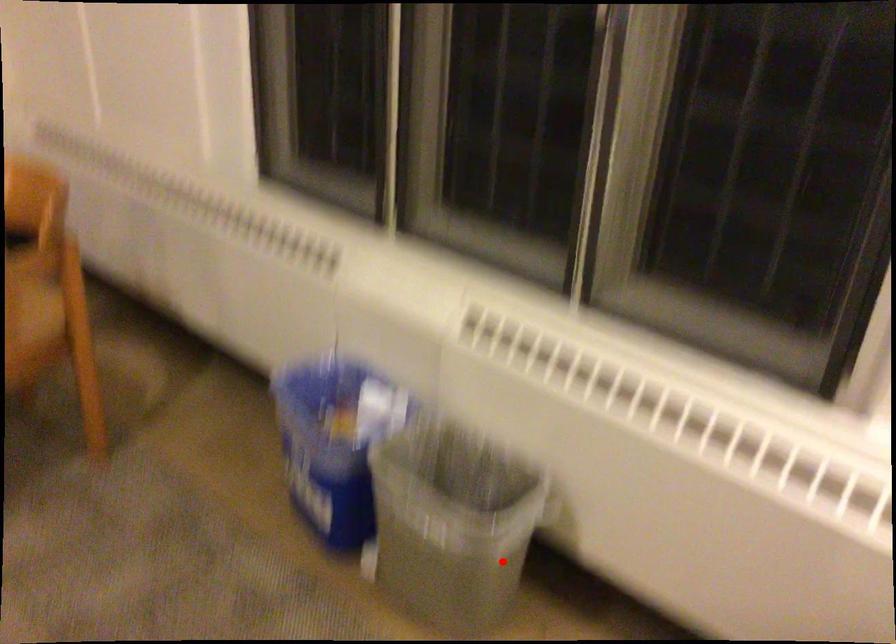
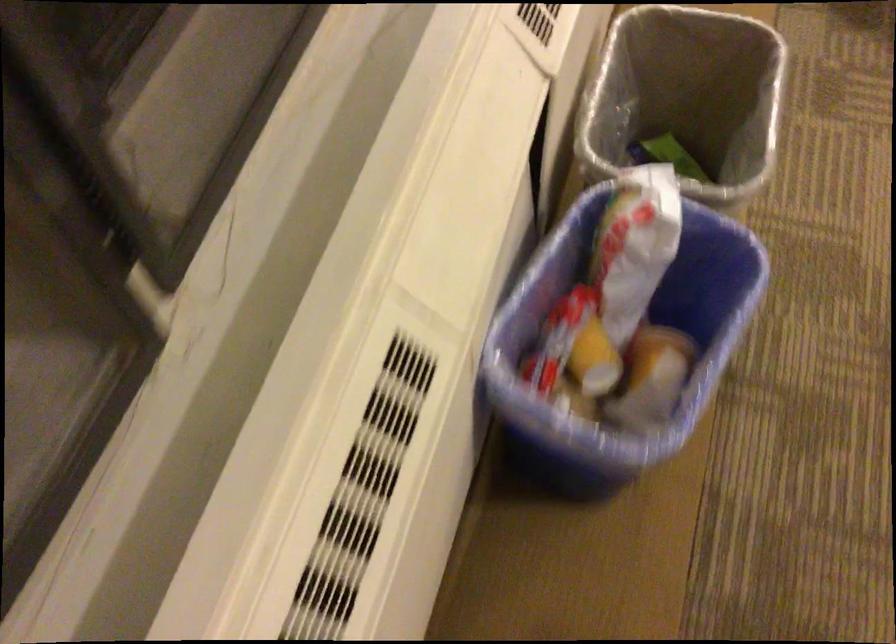
Question: A red point is marked in image1. In image2, is the corresponding 3D point closer to the camera or farther? Reply with the corresponding letter.

Choices:
 (A) The corresponding 3D point is closer.
 (B) The corresponding 3D point is farther.

Answer: (A)